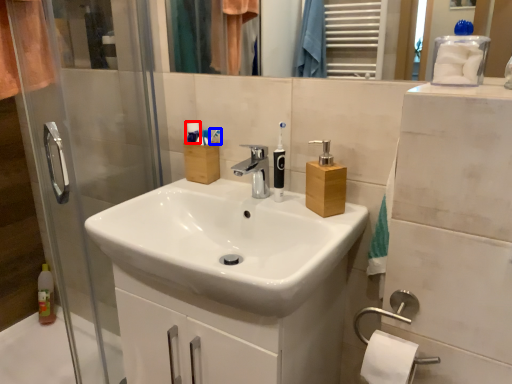
Question: Which object appears farthest to the camera in this image, toiletry (highlighted by a red box) or toothbrush (highlighted by a blue box)?

Choices:
 (A) toiletry
 (B) toothbrush

Answer: (A)